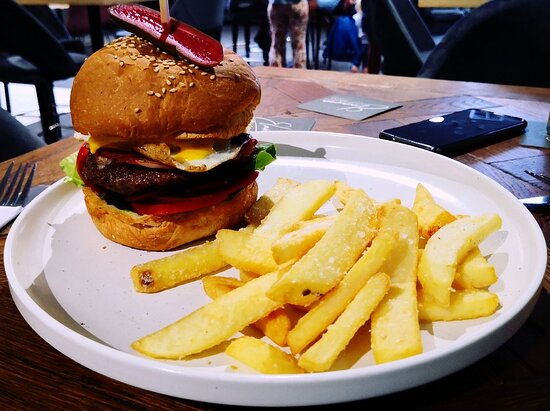
Identify the location of coaster. [x=345, y=104], [x=535, y=139], [x=296, y=120].